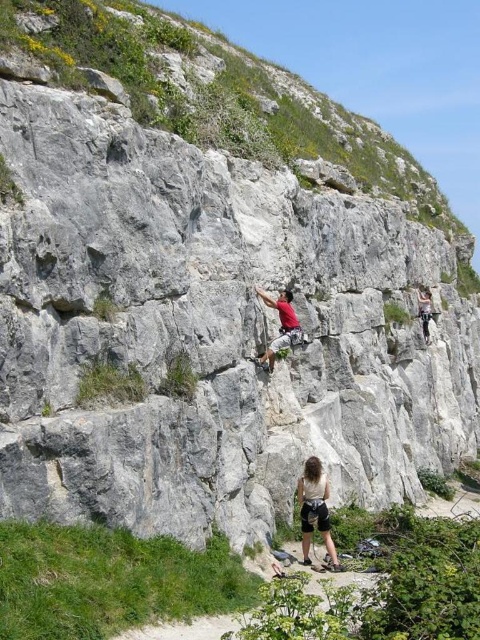
You are a rock climber preparing to ascend the white rock climbing wall at center. There is a matte red shirt at center nearby. Which object is bigger in size between the two?

The white rock climbing wall at center is larger in size than the matte red shirt at center.

You are a hiker planning to climb the cliff. You notice two climbers at the base of the cliff. One has dark gray fabric pants at center and the other has a matte red shirt at center. Which climber is lower in position?

The dark gray fabric pants at center is below the matte red shirt at center, so the climber with the dark gray fabric pants at center is lower in position.

You are a climber preparing to ascend the white rock climbing wall at center and the matte red shirt at center is your teammate. If you want to hand your teammate a safety harness, which object should you move towards?

The white rock climbing wall at center is closer to the viewer than the matte red shirt at center, so you should move towards the matte red shirt at center to hand them the safety harness.